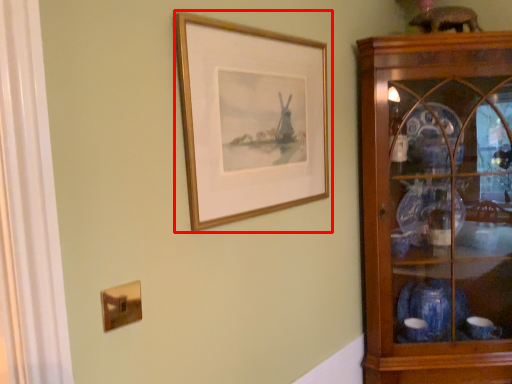
Question: From the image, what is the correct spatial relationship of picture frame (annotated by the red box) in relation to shelf?

Choices:
 (A) right
 (B) left

Answer: (B)